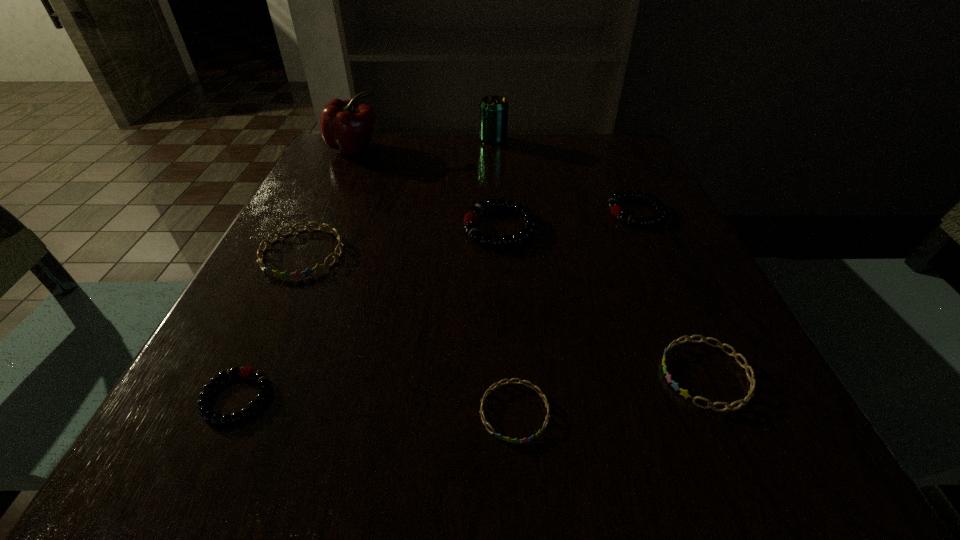
Where is `vacant space at the right edge`? This screenshot has width=960, height=540. vacant space at the right edge is located at coordinates (621, 280).

Where is `vacant point at the near left corner`? The image size is (960, 540). vacant point at the near left corner is located at coordinates (272, 454).

Where is `free space at the near right corner of the desktop`? The height and width of the screenshot is (540, 960). free space at the near right corner of the desktop is located at coordinates (717, 478).

You are a GUI agent. You are given a task and a screenshot of the screen. Output one action in this format:
    pyautogui.click(x=<x>, y=<y>)
    Task: Click on the free space between the rightmost blue bracelet and the beer can
    Image resolution: width=960 pixels, height=540 pixels.
    Given the screenshot: What is the action you would take?
    pyautogui.click(x=600, y=258)

This screenshot has height=540, width=960. I want to click on empty space between the shortest bracelet and the second biggest black bracelet, so click(575, 312).

Locate an element on the screen. The height and width of the screenshot is (540, 960). unoccupied area between the second black bracelet from right to left and the farthest blue bracelet is located at coordinates (401, 240).

Identify the location of free space that is in between the seventh shortest object and the smallest black bracelet. This screenshot has height=540, width=960. click(x=365, y=269).

Locate an element on the screen. The width and height of the screenshot is (960, 540). vacant area that lies between the second biggest blue bracelet and the rightmost black bracelet is located at coordinates (671, 293).

Find the location of a particular element. The image size is (960, 540). free point between the biggest black bracelet and the shortest bracelet is located at coordinates (507, 319).

Find the location of `vacant area between the second blue bracelet from right to left and the beer can`. vacant area between the second blue bracelet from right to left and the beer can is located at coordinates (504, 276).